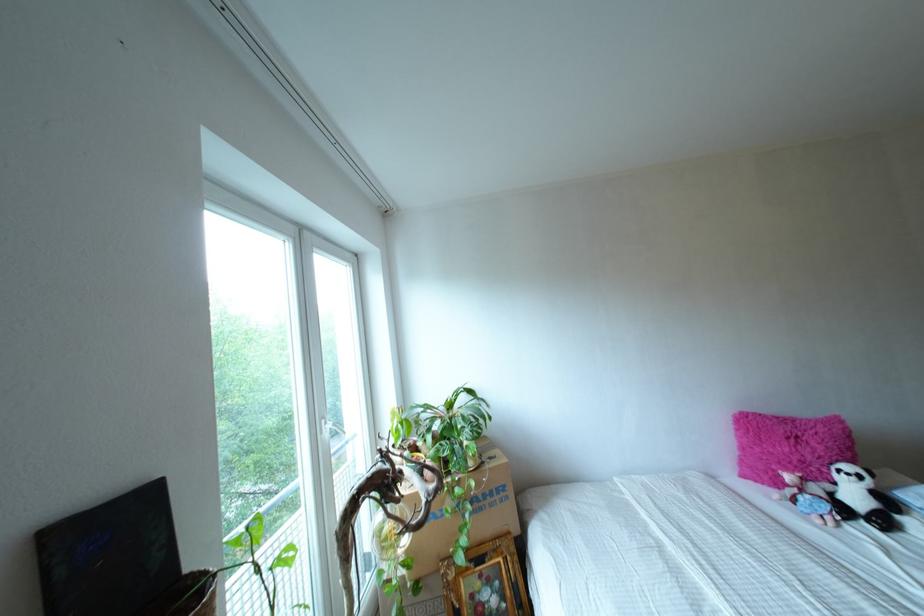
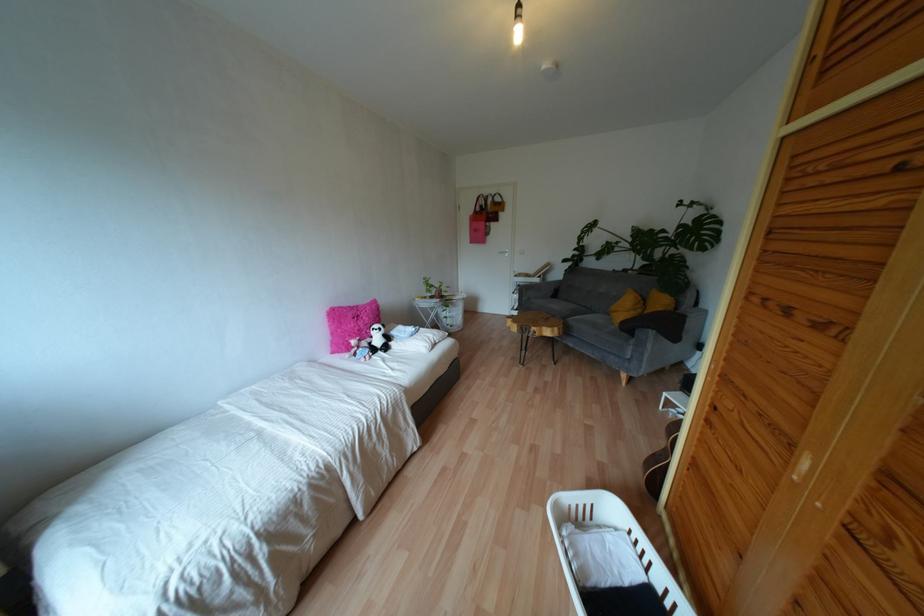
In the second image, find the point that corresponds to the point at 757,448 in the first image.

(338, 330)